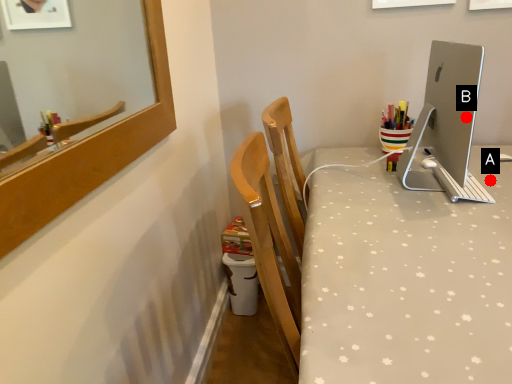
Question: Two points are circled on the image, labeled by A and B beside each circle. Which of the following is the farthest from the observer?

Choices:
 (A) A is further
 (B) B is further

Answer: (A)